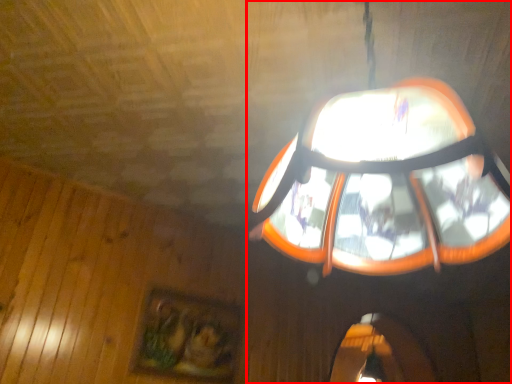
Question: From the image's perspective, considering the relative positions of lamp (annotated by the red box) and picture frame in the image provided, where is lamp (annotated by the red box) located with respect to the staircase?

Choices:
 (A) below
 (B) above

Answer: (B)